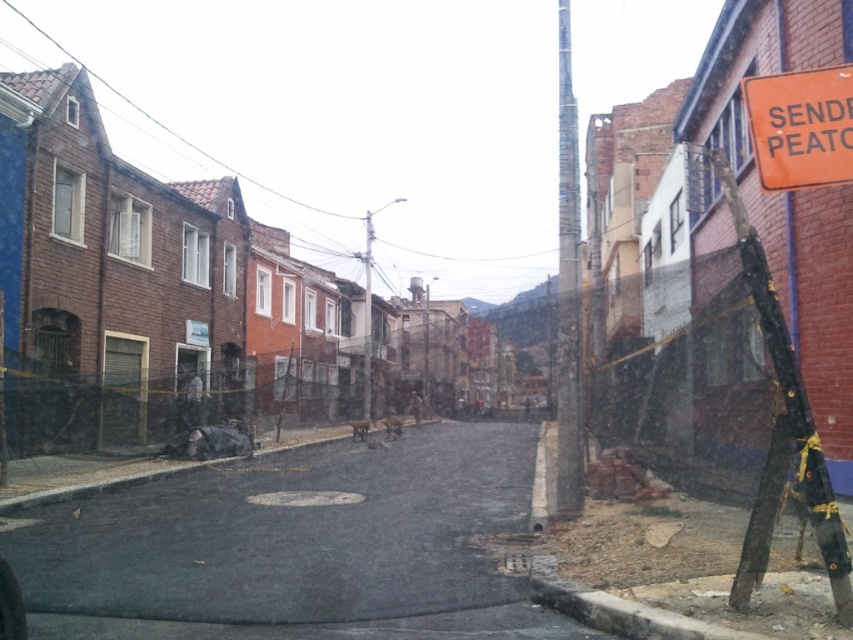
Between dark asphalt road at center and orange plastic sign at upper right, which one is positioned higher?

orange plastic sign at upper right is higher up.

Looking at this image, does dark asphalt road at center have a smaller size compared to orange plastic sign at upper right?

Actually, dark asphalt road at center might be larger than orange plastic sign at upper right.

What do you see at coordinates (296, 547) in the screenshot? I see `dark asphalt road at center` at bounding box center [296, 547].

Find the location of `dark asphalt road at center`. dark asphalt road at center is located at coordinates coord(296,547).